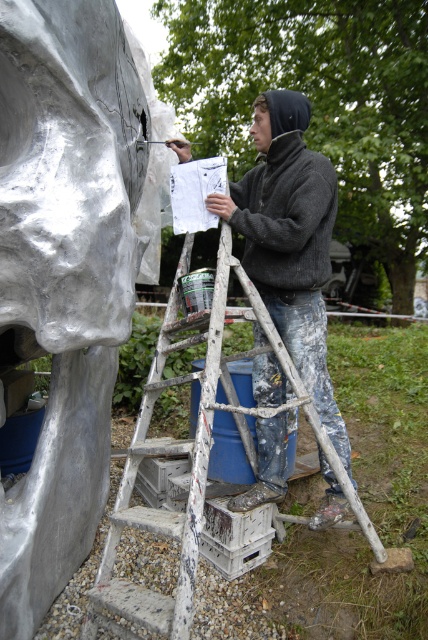
Question: Is gray fabric jacket at center to the left of white wooden ladder at center from the viewer's perspective?

Choices:
 (A) yes
 (B) no

Answer: (B)

Question: Which of the following is the closest to the observer?

Choices:
 (A) gray fabric jacket at center
 (B) white wooden ladder at center
 (C) brushed metal sculpture at left

Answer: (C)

Question: Is brushed metal sculpture at left to the right of white wooden ladder at center from the viewer's perspective?

Choices:
 (A) yes
 (B) no

Answer: (B)

Question: Which of the following is the closest to the observer?

Choices:
 (A) white wooden ladder at center
 (B) brushed metal sculpture at left
 (C) gray fabric jacket at center

Answer: (B)

Question: Does brushed metal sculpture at left have a greater width compared to white wooden ladder at center?

Choices:
 (A) yes
 (B) no

Answer: (B)

Question: Which point appears closest to the camera in this image?

Choices:
 (A) (265, 474)
 (B) (20, 529)
 (C) (187, 317)

Answer: (B)